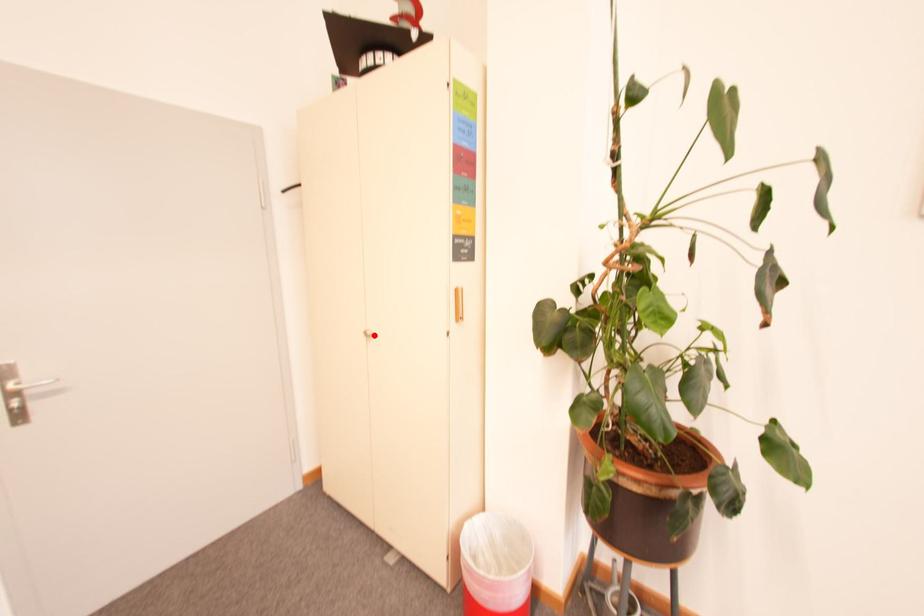
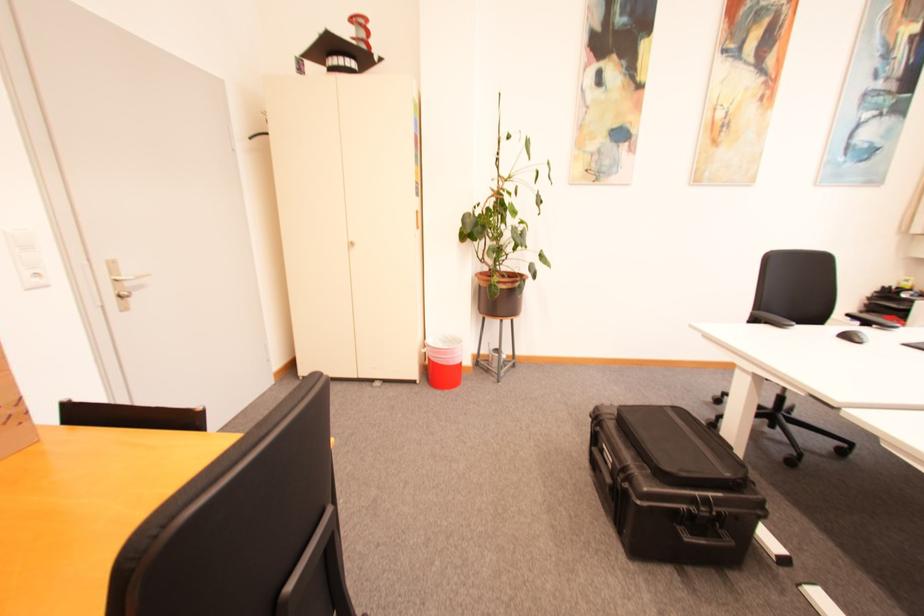
In the second image, find the point that corresponds to the highlighted location in the first image.

(359, 245)